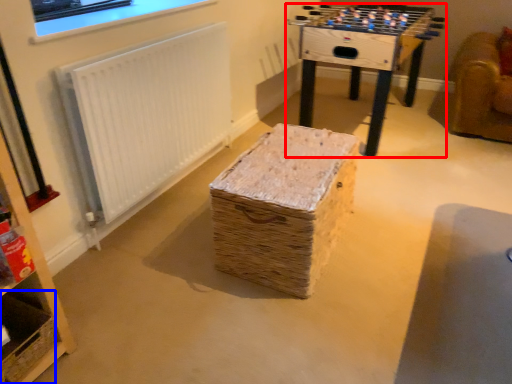
Question: Which object is further to the camera taking this photo, table (highlighted by a red box) or basket (highlighted by a blue box)?

Choices:
 (A) table
 (B) basket

Answer: (A)